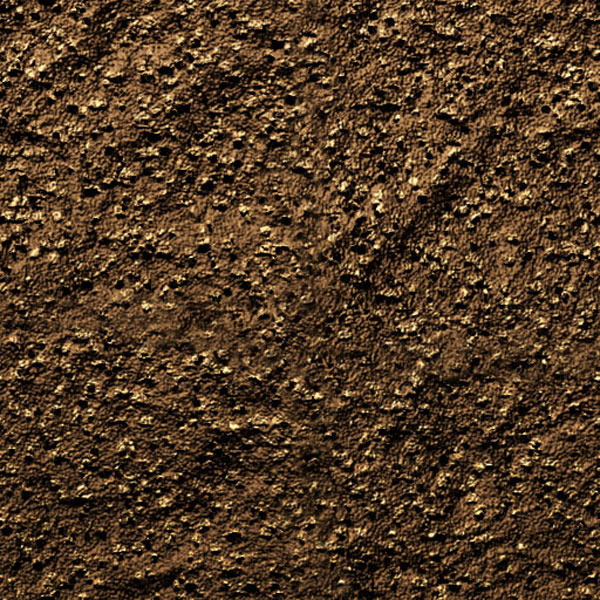
Locate an element on the screen. The width and height of the screenshot is (600, 600). prints is located at coordinates (415, 246), (221, 141).